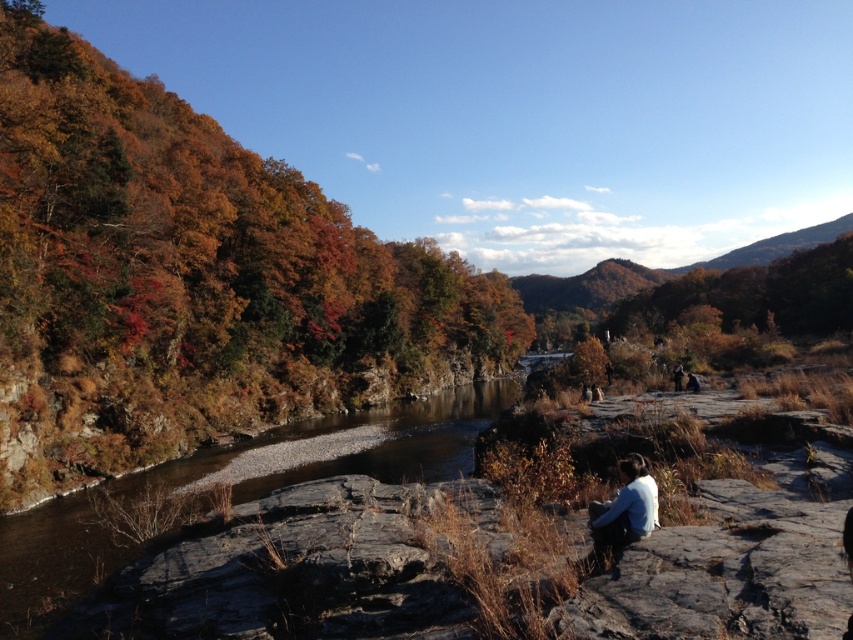
Question: Can you confirm if brown rocky creek at center is thinner than white cotton shirt at lower center?

Choices:
 (A) no
 (B) yes

Answer: (A)

Question: Can you confirm if brown rocky creek at center is positioned above white cotton shirt at lower center?

Choices:
 (A) no
 (B) yes

Answer: (A)

Question: Which point is closer to the camera?

Choices:
 (A) (614, 541)
 (B) (36, 596)

Answer: (A)

Question: Is brown rocky creek at center wider than white cotton shirt at lower center?

Choices:
 (A) yes
 (B) no

Answer: (A)